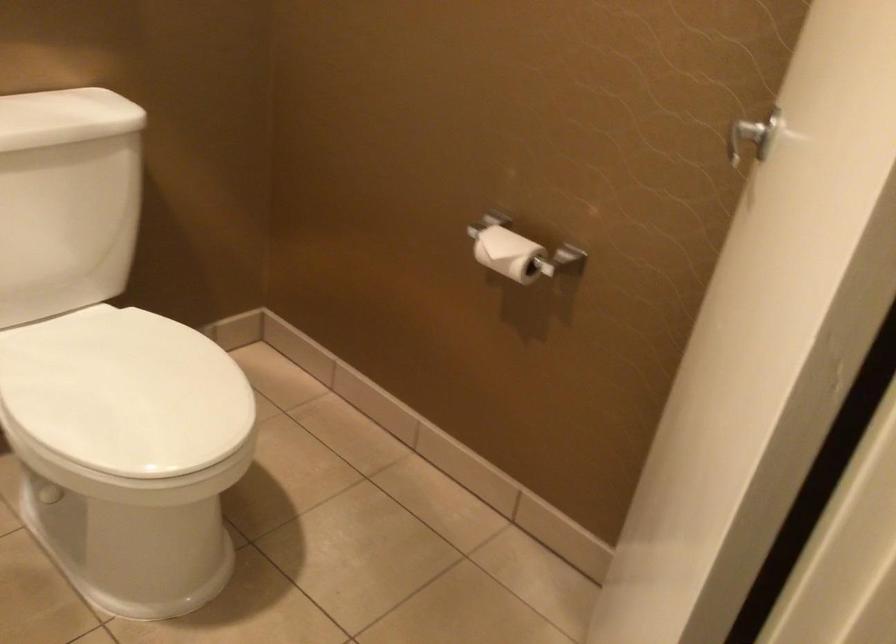
At what (x,y) coordinates should I click in order to perform the action: click on silver door handle. Please return your answer as a coordinate pair (x, y). The image size is (896, 644). Looking at the image, I should click on (745, 138).